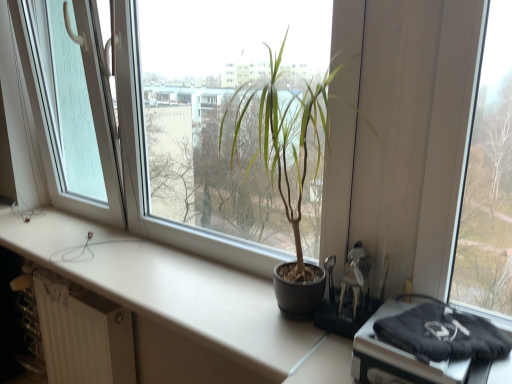
What are the coordinates of `vacant area situated below matte black pot at center (from a real-world perspective)` in the screenshot? It's located at (270, 317).